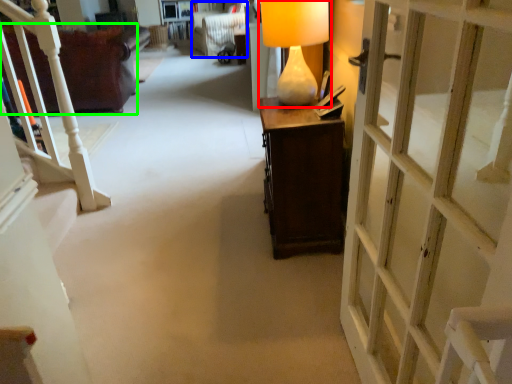
Question: Considering the real-world distances, which object is farthest from table lamp (highlighted by a red box)? armchair (highlighted by a blue box) or furniture (highlighted by a green box)?

Choices:
 (A) armchair
 (B) furniture

Answer: (A)